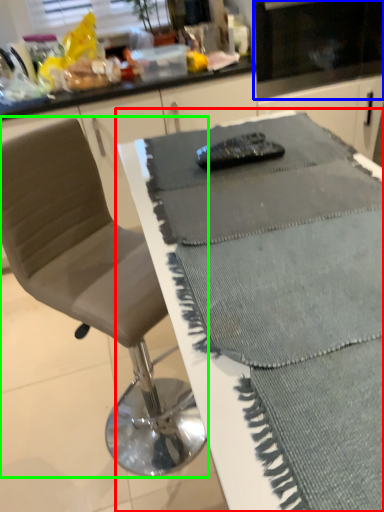
Question: Considering the real-world distances, which object is farthest from table (highlighted by a red box)? appliance (highlighted by a blue box) or chair (highlighted by a green box)?

Choices:
 (A) appliance
 (B) chair

Answer: (A)